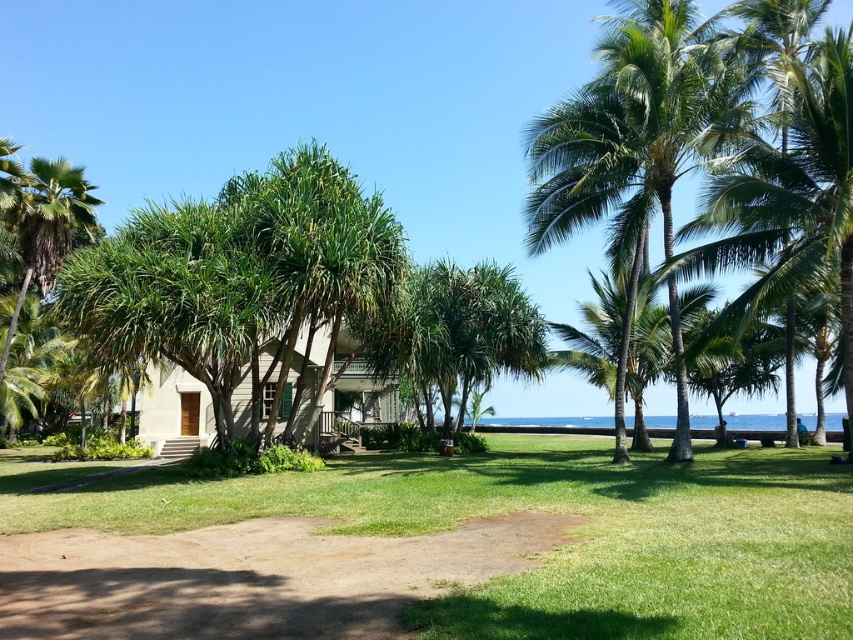
You are standing at the entrance of the house and want to walk to the brown dirt path at lower center. According to the coordinates given, where should you head?

The brown dirt path at lower center is located at point (x=251, y=577), so you should head towards that coordinate to reach it.

You are planning to walk from the brown dirt path at lower center to the green leafy palm tree at upper right. Considering the width of the path, will you have enough space to walk comfortably?

The brown dirt path at lower center has a lesser width compared to green leafy palm tree at upper right, so the path may be narrower than the palm tree, but since the palm tree is at the upper right, the path might still be wide enough for walking. However, the exact width isn